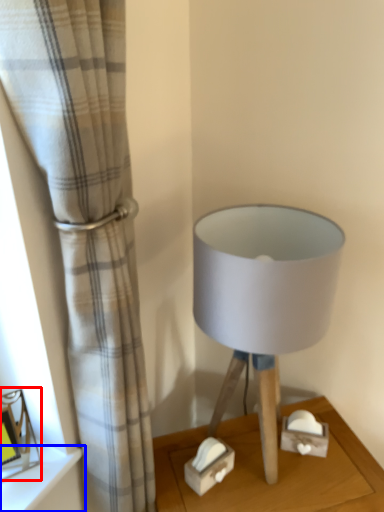
Question: Which object appears closest to the camera in this image, picture frame (highlighted by a red box) or shelf (highlighted by a blue box)?

Choices:
 (A) picture frame
 (B) shelf

Answer: (A)